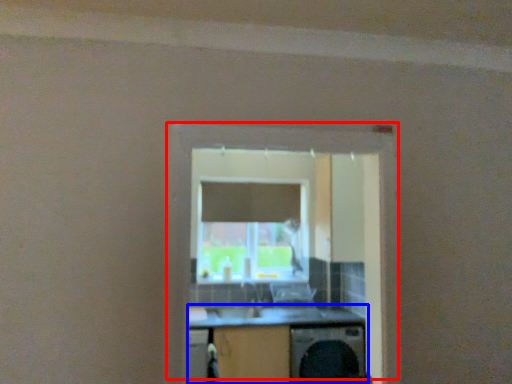
Question: Which object is closer to the camera taking this photo, window (highlighted by a red box) or computer desk (highlighted by a blue box)?

Choices:
 (A) window
 (B) computer desk

Answer: (A)